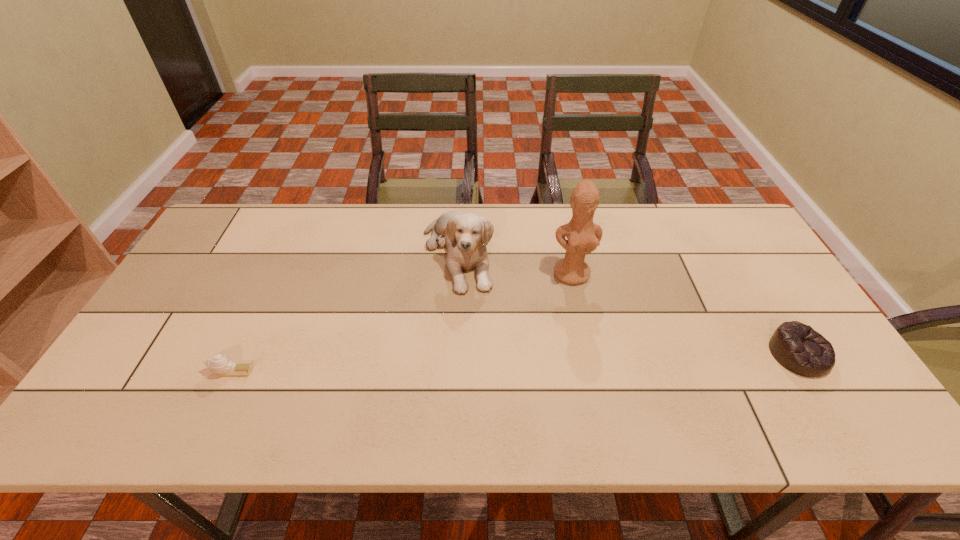
The height and width of the screenshot is (540, 960). Find the location of `free region located on the shell of the shortest object`. free region located on the shell of the shortest object is located at coordinates (176, 370).

Where is `vacant space situated 0.370m on the left of the rightmost object`? vacant space situated 0.370m on the left of the rightmost object is located at coordinates click(623, 354).

At what (x,y) coordinates should I click in order to perform the action: click on vacant area situated 0.160m on the front-facing side of the third shortest object. Please return your answer as a coordinate pair (x, y). The height and width of the screenshot is (540, 960). Looking at the image, I should click on (492, 334).

Where is `free space located 0.240m on the front-facing side of the third shortest object`? free space located 0.240m on the front-facing side of the third shortest object is located at coordinates (505, 357).

Find the location of `free space located 0.180m on the front-facing side of the third shortest object`. free space located 0.180m on the front-facing side of the third shortest object is located at coordinates (495, 340).

You are a GUI agent. You are given a task and a screenshot of the screen. Output one action in this format:
    pyautogui.click(x=<x>, y=<y>)
    Task: Click on the vacant point located on the front-facing side of the figurine
    The image size is (960, 540).
    Given the screenshot: What is the action you would take?
    pyautogui.click(x=585, y=319)

Where is `free region located on the front-facing side of the figurine`? The width and height of the screenshot is (960, 540). free region located on the front-facing side of the figurine is located at coordinates (585, 319).

Identify the location of free region located on the front-facing side of the figurine. This screenshot has width=960, height=540. (583, 310).

At what (x,y) coordinates should I click in order to perform the action: click on object located in the far edge section of the desktop. Please return your answer as a coordinate pair (x, y). The height and width of the screenshot is (540, 960). Looking at the image, I should click on (466, 235).

Locate an element on the screen. Image resolution: width=960 pixels, height=540 pixels. escargot that is at the near edge is located at coordinates [x=221, y=364].